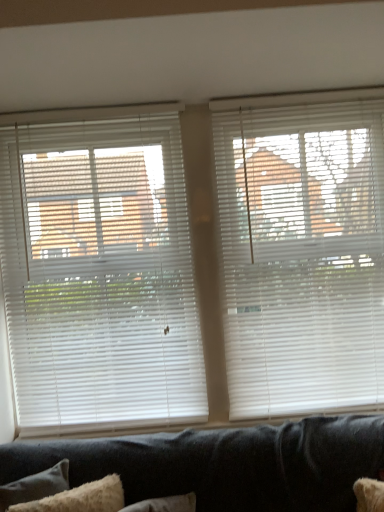
Question: Considering the relative sizes of white plastic blinds at upper right, arranged as the second window blind when viewed from the left, and fuzzy white pillow at lower left in the image provided, is white plastic blinds at upper right, arranged as the second window blind when viewed from the left, thinner than fuzzy white pillow at lower left?

Choices:
 (A) no
 (B) yes

Answer: (B)

Question: Is white plastic blinds at upper right, arranged as the second window blind when viewed from the left, next to fuzzy white pillow at lower left?

Choices:
 (A) yes
 (B) no

Answer: (B)

Question: Is white plastic blinds at upper right, arranged as the second window blind when viewed from the left, surrounding fuzzy white pillow at lower left?

Choices:
 (A) no
 (B) yes

Answer: (A)

Question: Is white plastic blinds at upper right, arranged as the second window blind when viewed from the left, oriented away from fuzzy white pillow at lower left?

Choices:
 (A) no
 (B) yes

Answer: (A)

Question: Can you confirm if white plastic blinds at upper right, arranged as the second window blind when viewed from the left, is bigger than fuzzy white pillow at lower left?

Choices:
 (A) yes
 (B) no

Answer: (A)

Question: Is white plastic blinds at upper right, arranged as the second window blind when viewed from the left, in front of or behind white plastic blinds at left, marked as the 2th window blind in a right-to-left arrangement, in the image?

Choices:
 (A) behind
 (B) front

Answer: (B)

Question: From the image's perspective, is white plastic blinds at upper right, acting as the 1th window blind starting from the right, positioned above or below white plastic blinds at left, marked as the 2th window blind in a right-to-left arrangement?

Choices:
 (A) above
 (B) below

Answer: (A)

Question: Considering the positions of white plastic blinds at upper right, acting as the 1th window blind starting from the right, and white plastic blinds at left, the 1th window blind when ordered from left to right, in the image, is white plastic blinds at upper right, acting as the 1th window blind starting from the right, wider or thinner than white plastic blinds at left, the 1th window blind when ordered from left to right,?

Choices:
 (A) wide
 (B) thin

Answer: (A)

Question: Is point (264, 282) positioned closer to the camera than point (127, 253)?

Choices:
 (A) farther
 (B) closer

Answer: (A)

Question: From the image's perspective, is white plastic blinds at upper right, arranged as the second window blind when viewed from the left, above or below fuzzy white pillow at lower left?

Choices:
 (A) below
 (B) above

Answer: (B)

Question: In the image, is white plastic blinds at upper right, acting as the 1th window blind starting from the right, positioned in front of or behind fuzzy white pillow at lower left?

Choices:
 (A) behind
 (B) front

Answer: (A)

Question: Would you say white plastic blinds at upper right, arranged as the second window blind when viewed from the left, is to the left or to the right of fuzzy white pillow at lower left in the picture?

Choices:
 (A) right
 (B) left

Answer: (A)

Question: Considering the positions of point (327, 322) and point (109, 476), is point (327, 322) closer or farther from the camera than point (109, 476)?

Choices:
 (A) farther
 (B) closer

Answer: (A)

Question: Considering their positions, is white plastic blinds at left, marked as the 2th window blind in a right-to-left arrangement, located in front of or behind white plastic blinds at upper right, arranged as the second window blind when viewed from the left?

Choices:
 (A) behind
 (B) front

Answer: (A)

Question: Which is correct: white plastic blinds at left, the 1th window blind when ordered from left to right, is inside white plastic blinds at upper right, arranged as the second window blind when viewed from the left, or outside of it?

Choices:
 (A) inside
 (B) outside

Answer: (B)